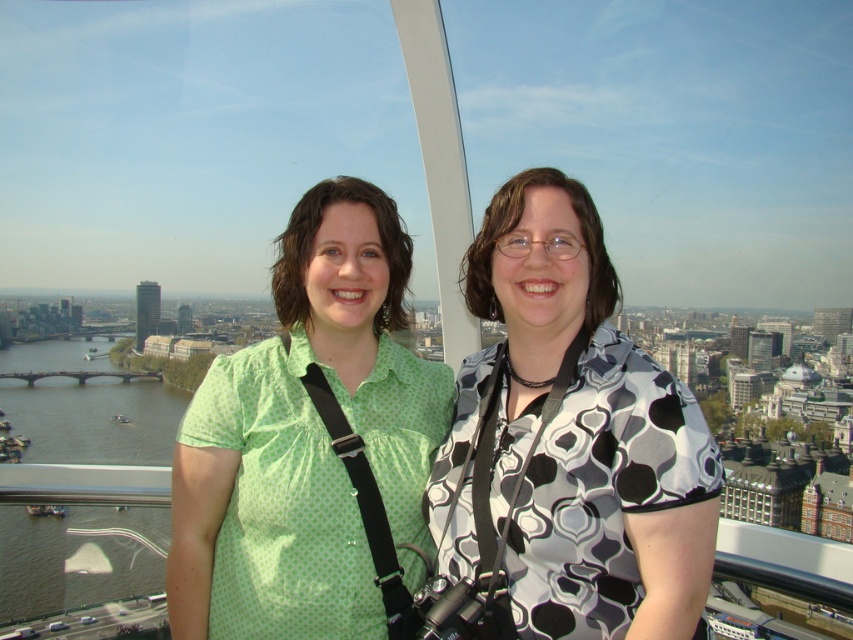
Question: Does black and white patterned shirt at center have a smaller size compared to smooth glass tower at center?

Choices:
 (A) yes
 (B) no

Answer: (B)

Question: Which of the following is the closest to the observer?

Choices:
 (A) green dotted shirt at center
 (B) green water at lower left

Answer: (A)

Question: Is the position of green water at lower left more distant than that of smooth glass tower at center?

Choices:
 (A) no
 (B) yes

Answer: (A)

Question: Is green water at lower left below smooth glass tower at center?

Choices:
 (A) yes
 (B) no

Answer: (A)

Question: Which object is the farthest from the black and white patterned shirt at center?

Choices:
 (A) smooth glass tower at center
 (B) green dotted shirt at center

Answer: (A)

Question: Which object appears closest to the camera in this image?

Choices:
 (A) black and white patterned shirt at center
 (B) smooth glass tower at center
 (C) green water at lower left

Answer: (A)